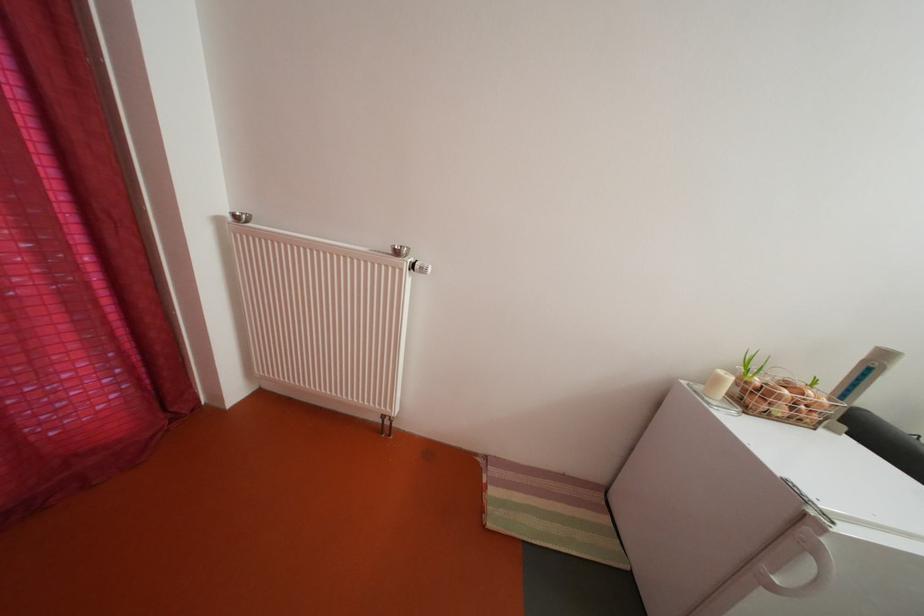
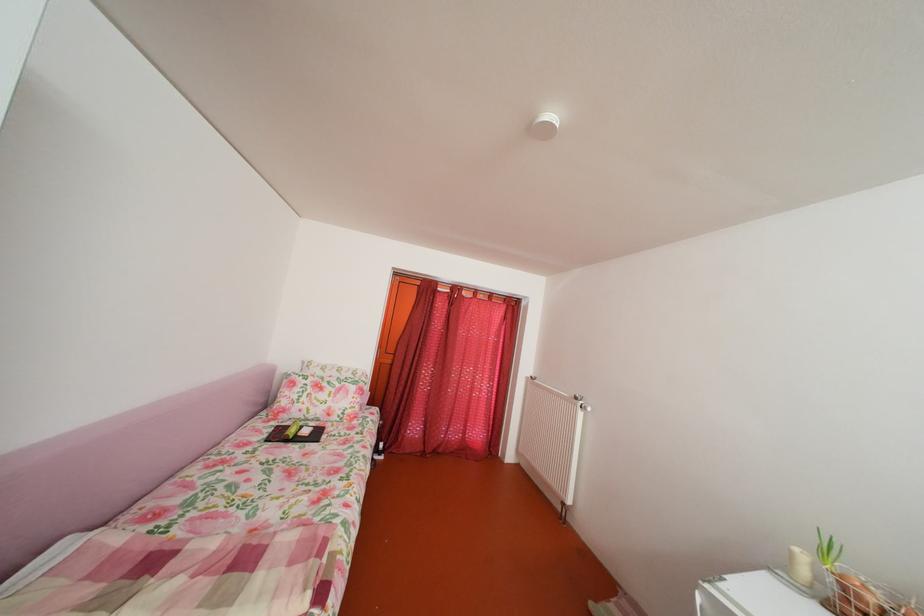
Where in the second image is the point corresponding to (x=407, y=259) from the first image?

(588, 405)